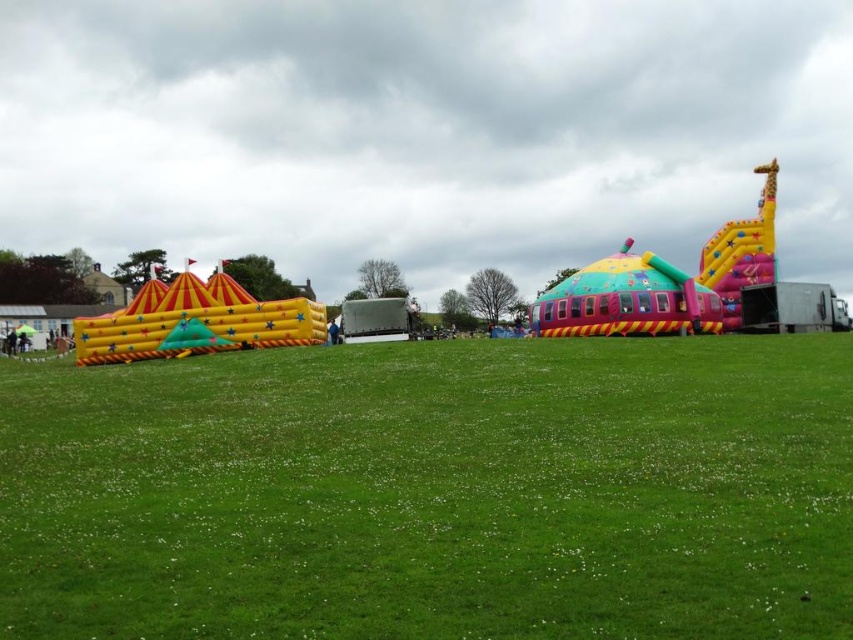
Question: Where is green grass at center located in relation to multicolored inflatable castle at center in the image?

Choices:
 (A) left
 (B) right

Answer: (B)

Question: Is green grass at center thinner than multicolored inflatable castle at center?

Choices:
 (A) no
 (B) yes

Answer: (B)

Question: Does green grass at center appear on the left side of multicolored inflatable castle at center?

Choices:
 (A) no
 (B) yes

Answer: (A)

Question: Which of the following is the closest to the observer?

Choices:
 (A) multicolored inflatable castle at center
 (B) green grass at center

Answer: (B)

Question: Which of the following is the closest to the observer?

Choices:
 (A) multicolored inflatable castle at center
 (B) green grass at center

Answer: (B)